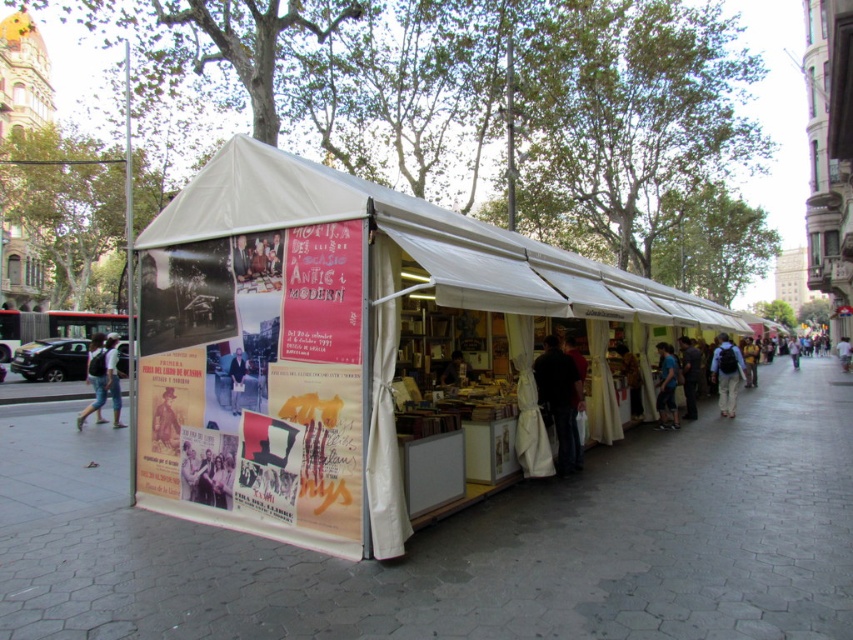
From the picture: You are a customer at the book stall and want to pick up the khaki pants at center and the light purple fabric at center. Which item will you need to reach further to get?

The light purple fabric at center is further away from you than the khaki pants at center, so you will need to reach further to get the light purple fabric at center.